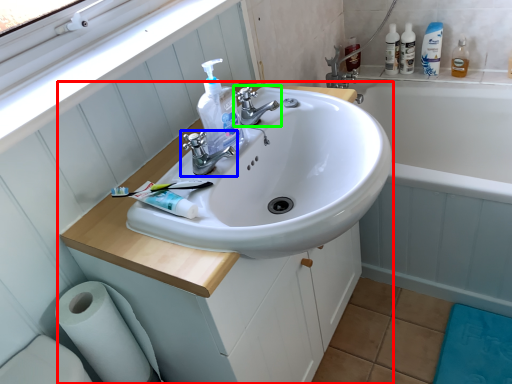
Question: Estimate the real-world distances between objects in this image. Which object is closer to bathroom cabinet (highlighted by a red box), tap (highlighted by a blue box) or tap (highlighted by a green box)?

Choices:
 (A) tap
 (B) tap

Answer: (A)